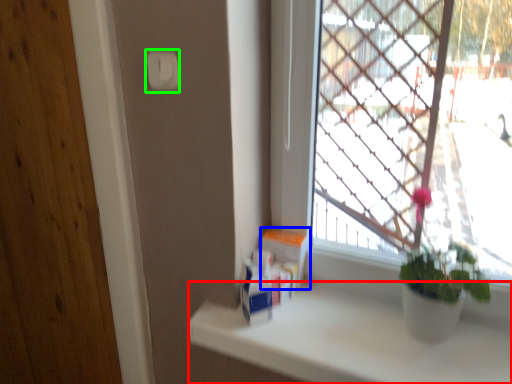
Question: Which object is the closest to the counter top (highlighted by a red box)? Choose among these: window box (highlighted by a blue box) or light switch (highlighted by a green box).

Choices:
 (A) window box
 (B) light switch

Answer: (A)